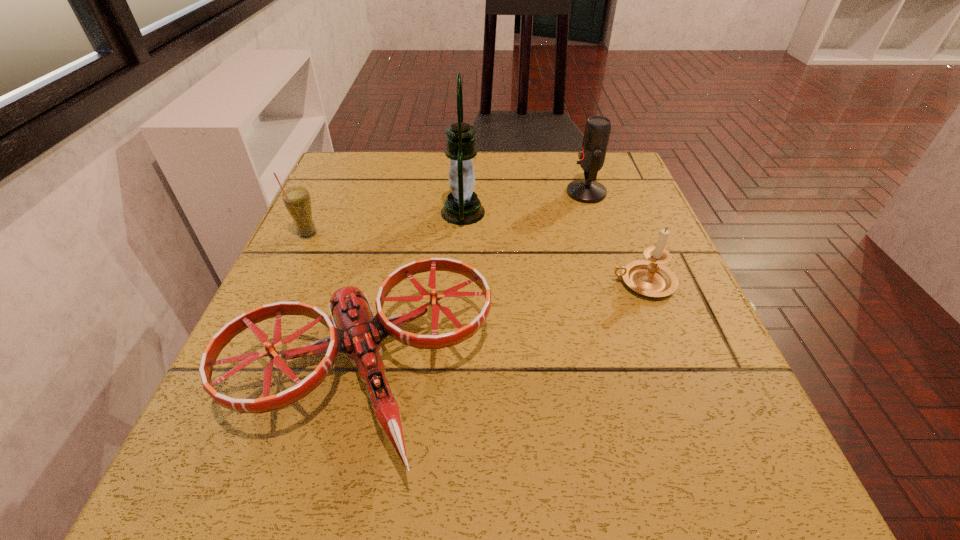
Where is `vacant space that is in between the drone and the tallest object`? vacant space that is in between the drone and the tallest object is located at coordinates (413, 294).

At what (x,y) coordinates should I click in order to perform the action: click on vacant space that is in between the candle holder and the tallest object. Please return your answer as a coordinate pair (x, y). This screenshot has width=960, height=540. Looking at the image, I should click on (553, 247).

At what (x,y) coordinates should I click in order to perform the action: click on free space between the straw for drinking and the candle holder. Please return your answer as a coordinate pair (x, y). The width and height of the screenshot is (960, 540). Looking at the image, I should click on (475, 258).

Where is `blank region between the drone and the candle holder`? Image resolution: width=960 pixels, height=540 pixels. blank region between the drone and the candle holder is located at coordinates (503, 329).

Locate an element on the screen. The width and height of the screenshot is (960, 540). vacant area that lies between the lantern and the straw for drinking is located at coordinates (385, 223).

Locate an element on the screen. object that is the closest to the candle holder is located at coordinates (592, 154).

The width and height of the screenshot is (960, 540). Identify the location of the third closest object relative to the drone. (650, 278).